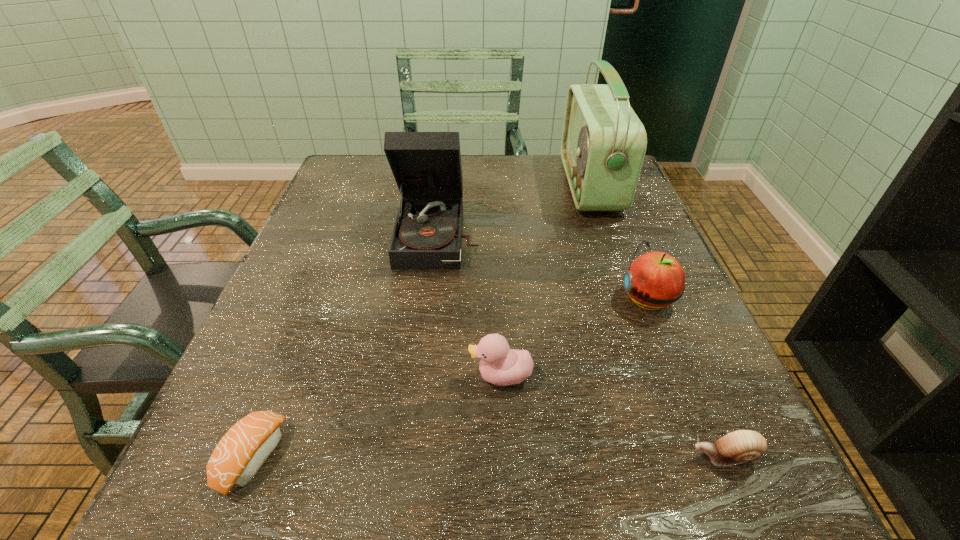
I want to click on blank area located on the right of the leftmost object, so click(x=528, y=457).

This screenshot has width=960, height=540. I want to click on object positioned at the far edge, so click(x=603, y=145).

Where is `escargot located at the near edge`? Image resolution: width=960 pixels, height=540 pixels. escargot located at the near edge is located at coordinates (739, 446).

Locate an element on the screen. sushi located at the near edge is located at coordinates (242, 451).

The height and width of the screenshot is (540, 960). I want to click on object that is at the left edge, so click(242, 451).

Where is `radio receiver that is positioned at the right edge`? Image resolution: width=960 pixels, height=540 pixels. radio receiver that is positioned at the right edge is located at coordinates (603, 145).

I want to click on apple that is positioned at the right edge, so click(655, 280).

Identify the location of escargot that is at the right edge. The width and height of the screenshot is (960, 540). (739, 446).

Identify the location of object that is at the near left corner. The width and height of the screenshot is (960, 540). (242, 451).

The width and height of the screenshot is (960, 540). Find the location of `object at the far right corner`. object at the far right corner is located at coordinates (603, 145).